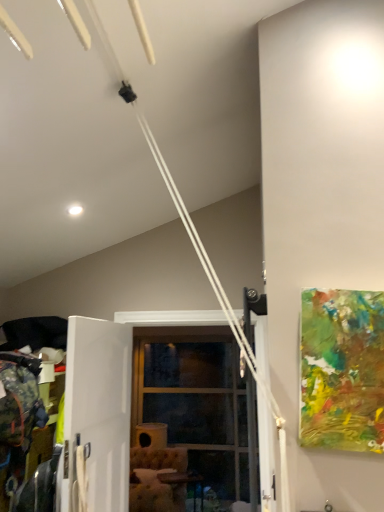
Question: From a real-world perspective, is clear glass door at center below wooden table at lower center?

Choices:
 (A) yes
 (B) no

Answer: (B)

Question: Does clear glass door at center have a larger size compared to wooden table at lower center?

Choices:
 (A) yes
 (B) no

Answer: (A)

Question: Is clear glass door at center positioned in front of wooden table at lower center?

Choices:
 (A) yes
 (B) no

Answer: (A)

Question: Is clear glass door at center looking in the opposite direction of wooden table at lower center?

Choices:
 (A) no
 (B) yes

Answer: (B)

Question: Would you say wooden table at lower center is part of clear glass door at center's contents?

Choices:
 (A) yes
 (B) no

Answer: (B)

Question: In the image, is white matte screen door at center on the left side or the right side of abstract painting at right?

Choices:
 (A) left
 (B) right

Answer: (A)

Question: Which is correct: white matte screen door at center is inside abstract painting at right, or outside of it?

Choices:
 (A) inside
 (B) outside

Answer: (B)

Question: From a real-world perspective, is white matte screen door at center positioned above or below abstract painting at right?

Choices:
 (A) above
 (B) below

Answer: (B)

Question: Is point (102, 338) positioned closer to the camera than point (322, 374)?

Choices:
 (A) closer
 (B) farther

Answer: (B)

Question: In terms of size, does white matte screen door at center appear bigger or smaller than wooden table at lower center?

Choices:
 (A) big
 (B) small

Answer: (A)

Question: Is point (122, 490) closer or farther from the camera than point (162, 473)?

Choices:
 (A) closer
 (B) farther

Answer: (A)

Question: Considering the relative positions of white matte screen door at center and wooden table at lower center in the image provided, is white matte screen door at center to the left or to the right of wooden table at lower center?

Choices:
 (A) right
 (B) left

Answer: (B)

Question: From the image's perspective, is white matte screen door at center positioned above or below wooden table at lower center?

Choices:
 (A) below
 (B) above

Answer: (B)

Question: From the image's perspective, relative to white matte screen door at center, is clear glass door at center above or below?

Choices:
 (A) below
 (B) above

Answer: (A)

Question: In the image, is clear glass door at center positioned in front of or behind white matte screen door at center?

Choices:
 (A) front
 (B) behind

Answer: (B)